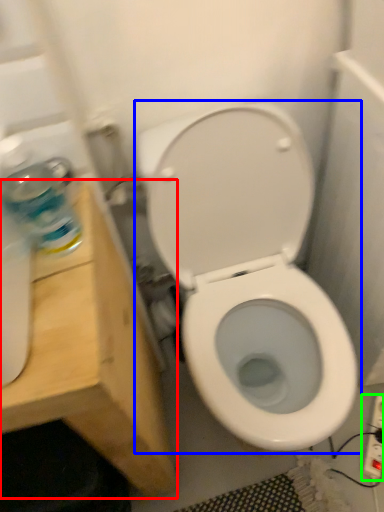
Question: Which object is the closest to the vanity (highlighted by a red box)? Choose among these: toilet (highlighted by a blue box) or electric outlet (highlighted by a green box).

Choices:
 (A) toilet
 (B) electric outlet

Answer: (A)